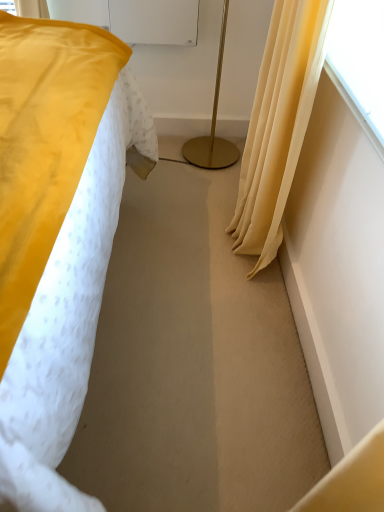
What do you see at coordinates (278, 125) in the screenshot?
I see `matte yellow curtain at right` at bounding box center [278, 125].

The height and width of the screenshot is (512, 384). Identify the location of matte yellow curtain at right. click(x=278, y=125).

Looking at this image, is gold metallic floor lamp at center positioned behind transparent plastic screen at upper right?

Yes, it is behind transparent plastic screen at upper right.

From the image's perspective, which object appears higher, gold metallic floor lamp at center or transparent plastic screen at upper right?

From the image's view, gold metallic floor lamp at center is above.

The width and height of the screenshot is (384, 512). Identify the location of window screen in front of the gold metallic floor lamp at center. (360, 56).

Which of these two, matte yellow curtain at right or gold metallic floor lamp at center, stands taller?

matte yellow curtain at right.

Between point (285, 78) and point (207, 142), which one is positioned behind?

Positioned behind is point (207, 142).

How many degrees apart are the facing directions of matte yellow curtain at right and gold metallic floor lamp at center?

matte yellow curtain at right and gold metallic floor lamp at center are facing 90 degrees away from each other.

Consider the image. Who is more distant, matte yellow curtain at right or gold metallic floor lamp at center?

Positioned behind is gold metallic floor lamp at center.

From the image's perspective, is transparent plastic screen at upper right over matte yellow curtain at right?

Correct, transparent plastic screen at upper right appears higher than matte yellow curtain at right in the image.

Considering the sizes of objects transparent plastic screen at upper right and matte yellow curtain at right in the image provided, who is smaller, transparent plastic screen at upper right or matte yellow curtain at right?

Smaller between the two is transparent plastic screen at upper right.

Does transparent plastic screen at upper right turn towards matte yellow curtain at right?

No.

Considering the sizes of transparent plastic screen at upper right and matte yellow curtain at right in the image, is transparent plastic screen at upper right wider or thinner than matte yellow curtain at right?

Clearly, transparent plastic screen at upper right has more width compared to matte yellow curtain at right.

Which object is closer to the camera, transparent plastic screen at upper right or gold metallic floor lamp at center?

Positioned in front is transparent plastic screen at upper right.

Could you tell me if transparent plastic screen at upper right is turned towards gold metallic floor lamp at center?

No, transparent plastic screen at upper right is not aimed at gold metallic floor lamp at center.

Looking at this image, who is taller, transparent plastic screen at upper right or gold metallic floor lamp at center?

With more height is gold metallic floor lamp at center.

Is matte yellow curtain at right beside transparent plastic screen at upper right?

matte yellow curtain at right and transparent plastic screen at upper right are clearly separated.

From a real-world perspective, does matte yellow curtain at right stand above transparent plastic screen at upper right?

No, from a real-world perspective, matte yellow curtain at right is not on top of transparent plastic screen at upper right.

From the picture: Based on their positions, is matte yellow curtain at right located to the left or right of transparent plastic screen at upper right?

Clearly, matte yellow curtain at right is on the left of transparent plastic screen at upper right in the image.

Is point (255, 100) closer to viewer compared to point (342, 27)?

No.

Considering the positions of objects gold metallic floor lamp at center and matte yellow curtain at right in the image provided, who is more to the right, gold metallic floor lamp at center or matte yellow curtain at right?

Positioned to the right is matte yellow curtain at right.

Looking at this image, does gold metallic floor lamp at center contain matte yellow curtain at right?

That's incorrect, matte yellow curtain at right is not inside gold metallic floor lamp at center.

The height and width of the screenshot is (512, 384). What are the coordinates of `bedside lamp below the matte yellow curtain at right (from a real-world perspective)` in the screenshot? It's located at (213, 126).

Based on the photo, does gold metallic floor lamp at center come behind matte yellow curtain at right?

Yes, gold metallic floor lamp at center is further from the camera.

Locate an element on the screen. This screenshot has width=384, height=512. bedside lamp on the left of transparent plastic screen at upper right is located at coordinates (213, 126).

The height and width of the screenshot is (512, 384). Identify the location of curtain below the gold metallic floor lamp at center (from the image's perspective). (278, 125).

From the image, which object appears to be nearer to transparent plastic screen at upper right, gold metallic floor lamp at center or matte yellow curtain at right?

matte yellow curtain at right is closer to transparent plastic screen at upper right.

Estimate the real-world distances between objects in this image. Which object is closer to matte yellow curtain at right, transparent plastic screen at upper right or gold metallic floor lamp at center?

transparent plastic screen at upper right is closer to matte yellow curtain at right.

Considering their positions, is gold metallic floor lamp at center positioned closer to matte yellow curtain at right than transparent plastic screen at upper right?

transparent plastic screen at upper right is positioned closer to the anchor matte yellow curtain at right.

Considering their positions, is matte yellow curtain at right positioned closer to transparent plastic screen at upper right than gold metallic floor lamp at center?

matte yellow curtain at right.

Considering their positions, is matte yellow curtain at right positioned further to gold metallic floor lamp at center than transparent plastic screen at upper right?

Among the two, transparent plastic screen at upper right is located further to gold metallic floor lamp at center.

Consider the image. Looking at the image, which one is located further to gold metallic floor lamp at center, transparent plastic screen at upper right or matte yellow curtain at right?

transparent plastic screen at upper right lies further to gold metallic floor lamp at center than the other object.

At what (x,y) coordinates should I click in order to perform the action: click on curtain between transparent plastic screen at upper right and gold metallic floor lamp at center from front to back. Please return your answer as a coordinate pair (x, y). Looking at the image, I should click on (278, 125).